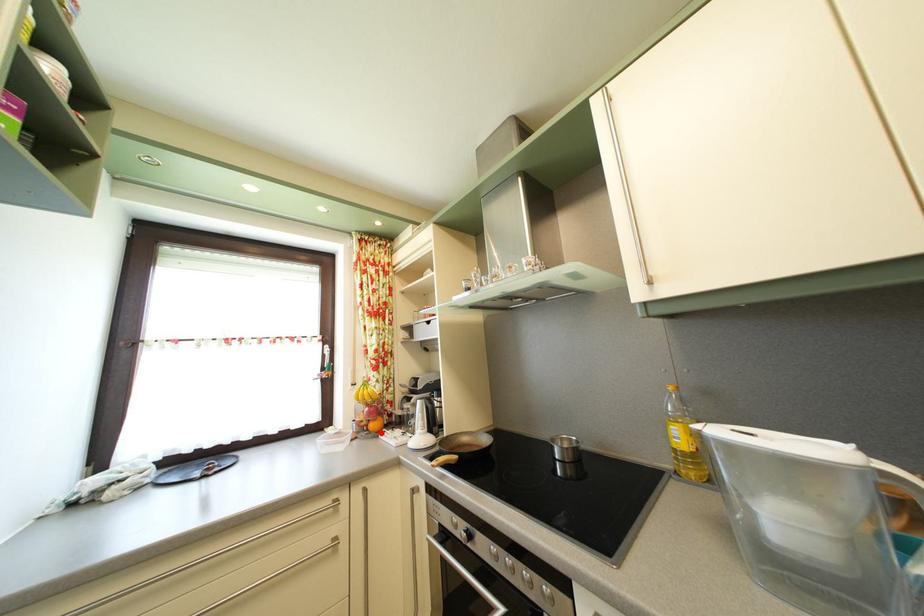
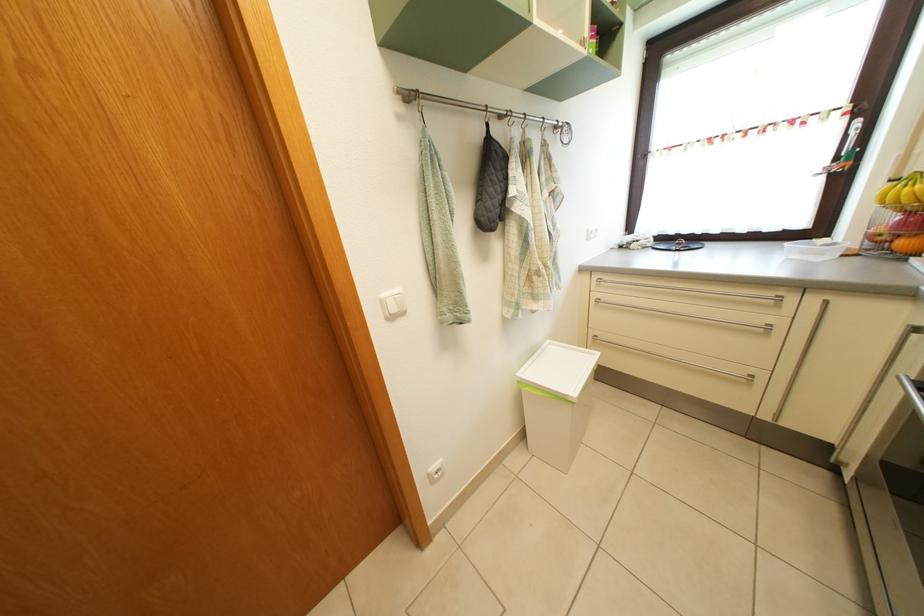
Question: I am providing you with two images of the same scene from different viewpoints. A red point is marked on the first image. Is the red point's position out of view in image 2?

Choices:
 (A) Yes
 (B) No

Answer: (B)